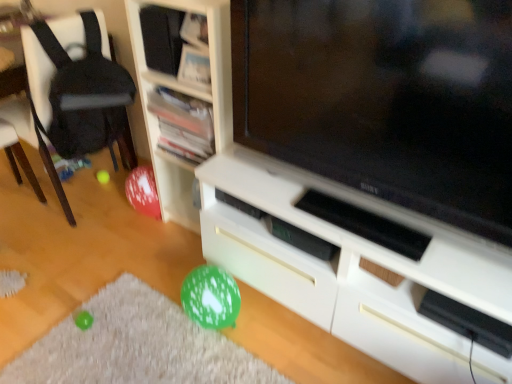
In order to face matte black speaker at upper center, which is the first shelf from top to bottom, should I rotate leftwards or rightwards?

It's best to rotate left around 11.967 degrees.

Image resolution: width=512 pixels, height=384 pixels. What do you see at coordinates (143, 49) in the screenshot?
I see `matte black speaker at upper center, which is the first shelf from top to bottom` at bounding box center [143, 49].

This screenshot has height=384, width=512. What are the coordinates of `white wood shelf at center, positioned as the first shelf in bottom-to-top order` in the screenshot? It's located at (189, 95).

In order to click on wooden bookshelf at upper center, which appears as the 2th shelf when ordered from the bottom in this screenshot , I will do `click(180, 119)`.

Which object is further away from the camera taking this photo, matte black speaker at upper center, placed as the 3th shelf when sorted from bottom to top, or white matte cabinet at center?

matte black speaker at upper center, placed as the 3th shelf when sorted from bottom to top.

From a real-world perspective, is matte black speaker at upper center, which is the first shelf from top to bottom, above or below white matte cabinet at center?

In terms of real-world spatial position, matte black speaker at upper center, which is the first shelf from top to bottom, is above white matte cabinet at center.

I want to click on cabinetry on the right of matte black speaker at upper center, placed as the 3th shelf when sorted from bottom to top, so click(347, 274).

Is black fabric chair at left shorter than white matte cabinet at center?

No.

How many degrees apart are the facing directions of black fabric chair at left and white matte cabinet at center?

The facing directions of black fabric chair at left and white matte cabinet at center are 0.573 degrees apart.

Would you consider black fabric chair at left to be distant from white matte cabinet at center?

Actually, black fabric chair at left and white matte cabinet at center are a little close together.

Is black fabric chair at left positioned behind white matte cabinet at center?

Yes, black fabric chair at left is further from the viewer.

From a real-world perspective, which object rests below the other?

matte black television at center.

Considering the positions of objects matte black television at center and matte black speaker at upper center, placed as the 3th shelf when sorted from bottom to top, in the image provided, who is behind, matte black television at center or matte black speaker at upper center, placed as the 3th shelf when sorted from bottom to top,?

matte black speaker at upper center, placed as the 3th shelf when sorted from bottom to top.

How distant is matte black television at center from matte black speaker at upper center, which is the first shelf from top to bottom?

matte black television at center and matte black speaker at upper center, which is the first shelf from top to bottom, are 55.84 centimeters apart.

Is matte black television at center aimed at matte black speaker at upper center, placed as the 3th shelf when sorted from bottom to top?

No, matte black television at center is not aimed at matte black speaker at upper center, placed as the 3th shelf when sorted from bottom to top.

Is wooden bookshelf at upper center, which appears as the 2th shelf when ordered from the bottom, positioned behind white matte cabinet at center?

Yes, it is.

Based on the photo, are wooden bookshelf at upper center, the 2th shelf when ordered from top to bottom, and white matte cabinet at center making contact?

No, wooden bookshelf at upper center, the 2th shelf when ordered from top to bottom, is not in contact with white matte cabinet at center.

Considering the positions of objects wooden bookshelf at upper center, which appears as the 2th shelf when ordered from the bottom, and white matte cabinet at center in the image provided, who is more to the left, wooden bookshelf at upper center, which appears as the 2th shelf when ordered from the bottom, or white matte cabinet at center?

wooden bookshelf at upper center, which appears as the 2th shelf when ordered from the bottom, is more to the left.

Can you tell me how much wooden bookshelf at upper center, the 2th shelf when ordered from top to bottom, and white matte cabinet at center differ in facing direction?

The angle between the facing direction of wooden bookshelf at upper center, the 2th shelf when ordered from top to bottom, and the facing direction of white matte cabinet at center is 0.272 degrees.

Who is bigger, white wood shelf at center, positioned as the first shelf in bottom-to-top order, or white matte cabinet at center?

white matte cabinet at center is bigger.

From their relative heights in the image, would you say white wood shelf at center, marked as the third shelf in a top-to-bottom arrangement, is taller or shorter than white matte cabinet at center?

white wood shelf at center, marked as the third shelf in a top-to-bottom arrangement, is taller than white matte cabinet at center.

Considering the positions of objects white wood shelf at center, marked as the third shelf in a top-to-bottom arrangement, and white matte cabinet at center in the image provided, who is in front, white wood shelf at center, marked as the third shelf in a top-to-bottom arrangement, or white matte cabinet at center?

white matte cabinet at center is closer to the camera.

Is wooden bookshelf at upper center, which appears as the 2th shelf when ordered from the bottom, inside or outside of matte black speaker at upper center, which is the first shelf from top to bottom?

wooden bookshelf at upper center, which appears as the 2th shelf when ordered from the bottom, is not enclosed by matte black speaker at upper center, which is the first shelf from top to bottom.

Can you tell me how much wooden bookshelf at upper center, which appears as the 2th shelf when ordered from the bottom, and matte black speaker at upper center, placed as the 3th shelf when sorted from bottom to top, differ in facing direction?

The angle between the facing direction of wooden bookshelf at upper center, which appears as the 2th shelf when ordered from the bottom, and the facing direction of matte black speaker at upper center, placed as the 3th shelf when sorted from bottom to top, is 0.00176 degrees.

Considering the positions of point (168, 129) and point (212, 15), is point (168, 129) closer or farther from the camera than point (212, 15)?

Point (168, 129) appears to be farther away from the viewer than point (212, 15).

Can we say white wood shelf at center, marked as the third shelf in a top-to-bottom arrangement, lies outside matte black speaker at upper center, placed as the 3th shelf when sorted from bottom to top?

Yes.

From a real-world perspective, is white wood shelf at center, marked as the third shelf in a top-to-bottom arrangement, above or below matte black speaker at upper center, placed as the 3th shelf when sorted from bottom to top?

In terms of real-world spatial position, white wood shelf at center, marked as the third shelf in a top-to-bottom arrangement, is below matte black speaker at upper center, placed as the 3th shelf when sorted from bottom to top.

Can you confirm if white wood shelf at center, positioned as the first shelf in bottom-to-top order, is bigger than matte black speaker at upper center, placed as the 3th shelf when sorted from bottom to top?

Correct, white wood shelf at center, positioned as the first shelf in bottom-to-top order, is larger in size than matte black speaker at upper center, placed as the 3th shelf when sorted from bottom to top.

From the image's perspective, which one is positioned higher, white wood shelf at center, marked as the third shelf in a top-to-bottom arrangement, or matte black speaker at upper center, placed as the 3th shelf when sorted from bottom to top?

matte black speaker at upper center, placed as the 3th shelf when sorted from bottom to top, appears higher in the image.

The width and height of the screenshot is (512, 384). I want to click on cabinetry that appears in front of the matte black speaker at upper center, placed as the 3th shelf when sorted from bottom to top, so click(347, 274).

Where is `cabinetry lying below the black fabric chair at left (from the image's perspective)`? This screenshot has width=512, height=384. cabinetry lying below the black fabric chair at left (from the image's perspective) is located at coordinates (347, 274).

Looking at the image, which one is located closer to matte black television at center, wooden bookshelf at upper center, the 2th shelf when ordered from top to bottom, or white wood shelf at center, marked as the third shelf in a top-to-bottom arrangement?

white wood shelf at center, marked as the third shelf in a top-to-bottom arrangement, is closer to matte black television at center.

Based on their spatial positions, is matte black speaker at upper center, placed as the 3th shelf when sorted from bottom to top, or black fabric chair at left closer to matte black television at center?

Based on the image, matte black speaker at upper center, placed as the 3th shelf when sorted from bottom to top, appears to be nearer to matte black television at center.

Based on their spatial positions, is matte black television at center or matte black speaker at upper center, which is the first shelf from top to bottom, further from wooden bookshelf at upper center, which appears as the 2th shelf when ordered from the bottom?

Among the two, matte black television at center is located further to wooden bookshelf at upper center, which appears as the 2th shelf when ordered from the bottom.

Considering their positions, is white matte cabinet at center positioned further to matte black television at center than matte black speaker at upper center, placed as the 3th shelf when sorted from bottom to top?

The object further to matte black television at center is matte black speaker at upper center, placed as the 3th shelf when sorted from bottom to top.

Estimate the real-world distances between objects in this image. Which object is closer to matte black speaker at upper center, which is the first shelf from top to bottom, matte black television at center or white matte cabinet at center?

The object closer to matte black speaker at upper center, which is the first shelf from top to bottom, is matte black television at center.

When comparing their distances from black fabric chair at left, does matte black television at center or wooden bookshelf at upper center, which appears as the 2th shelf when ordered from the bottom, seem closer?

wooden bookshelf at upper center, which appears as the 2th shelf when ordered from the bottom.

Estimate the real-world distances between objects in this image. Which object is further from white matte cabinet at center, matte black television at center or wooden bookshelf at upper center, the 2th shelf when ordered from top to bottom?

The object further to white matte cabinet at center is wooden bookshelf at upper center, the 2th shelf when ordered from top to bottom.

Based on their spatial positions, is black fabric chair at left or white wood shelf at center, positioned as the first shelf in bottom-to-top order, further from matte black television at center?

Among the two, black fabric chair at left is located further to matte black television at center.

Identify the location of shelf located between black fabric chair at left and wooden bookshelf at upper center, which appears as the 2th shelf when ordered from the bottom, in the left-right direction. (143, 49).

Image resolution: width=512 pixels, height=384 pixels. Find the location of `television between white wood shelf at center, marked as the third shelf in a top-to-bottom arrangement, and white matte cabinet at center`. television between white wood shelf at center, marked as the third shelf in a top-to-bottom arrangement, and white matte cabinet at center is located at coordinates (384, 100).

Locate an element on the screen. cabinetry located between matte black television at center and matte black speaker at upper center, which is the first shelf from top to bottom, in the depth direction is located at coordinates (347, 274).

The width and height of the screenshot is (512, 384). Find the location of `shelf that lies between matte black speaker at upper center, placed as the 3th shelf when sorted from bottom to top, and white wood shelf at center, marked as the third shelf in a top-to-bottom arrangement, from top to bottom`. shelf that lies between matte black speaker at upper center, placed as the 3th shelf when sorted from bottom to top, and white wood shelf at center, marked as the third shelf in a top-to-bottom arrangement, from top to bottom is located at coordinates (180, 119).